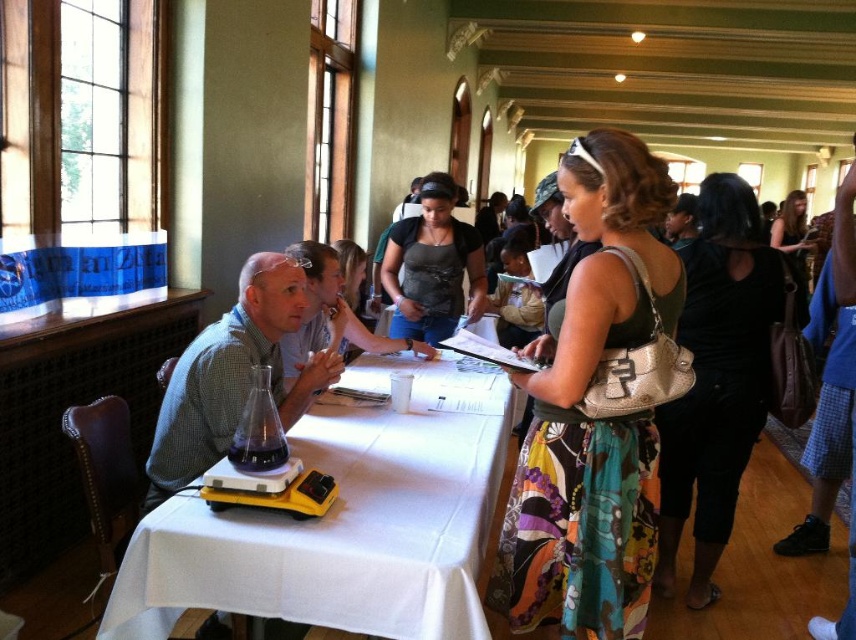
Question: Which object is positioned closest to the matte black tank top at center?

Choices:
 (A) multicolored fabric skirt at center
 (B) matte gray tank top at center
 (C) dark brown leather purse at upper right
 (D) matte green shirt at center

Answer: (B)

Question: Which point is farther to the camera?

Choices:
 (A) (739, 442)
 (B) (783, 209)

Answer: (B)

Question: Does matte black tank top at center have a greater width compared to matte black shirt at center?

Choices:
 (A) no
 (B) yes

Answer: (A)

Question: Which of these objects is positioned closest to the matte gray tank top at center?

Choices:
 (A) black velvet dress at center
 (B) multicolored fabric skirt at center

Answer: (B)

Question: Is white cloth table at center smaller than black velvet dress at center?

Choices:
 (A) yes
 (B) no

Answer: (A)

Question: Can you confirm if black velvet dress at center is smaller than matte black tank top at center?

Choices:
 (A) yes
 (B) no

Answer: (B)